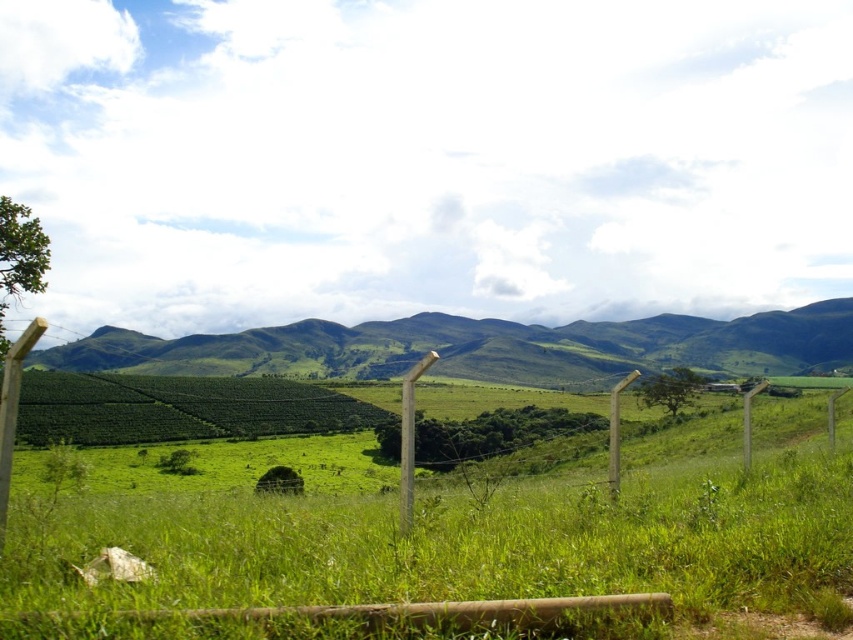
You are standing at the wooden fence in the rural landscape and want to determine the relative positions of two points marked in the scene. Which point, point (3, 483) or point (410, 376), is closer to you?

Point (3, 483) is closer to you because it is in front of point (410, 376).

You are a farmer checking the growth of your crops. You notice the green grassy field at center and the wooden post at left. Which one has a greater height?

The green grassy field at center is taller than the wooden post at left according to the description provided.

You are a farmer planning to plant new crops. You have a limited amount of seeds and want to use them efficiently. Which area should you prioritize planting in between the green grassy field at center and the wooden post at left, considering their sizes?

The green grassy field at center is larger in size than the wooden post at left, so you should prioritize planting in the green grassy field at center to make the most efficient use of your seeds.